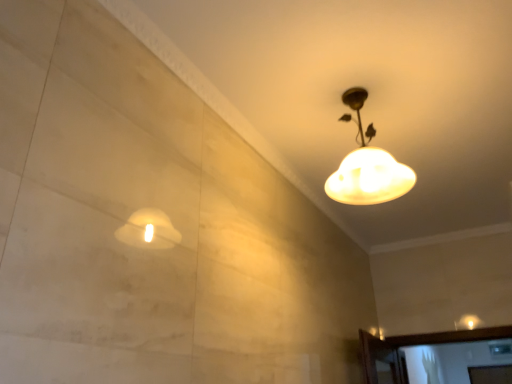
What are the coordinates of `cloud-shaped lampshade at upper right` in the screenshot? It's located at (367, 166).

What do you see at coordinates (367, 166) in the screenshot? I see `cloud-shaped lampshade at upper right` at bounding box center [367, 166].

You are a GUI agent. You are given a task and a screenshot of the screen. Output one action in this format:
    pyautogui.click(x=<x>, y=<y>)
    Task: Click on the cloud-shaped lampshade at upper right
    The image size is (512, 384).
    Given the screenshot: What is the action you would take?
    pyautogui.click(x=367, y=166)